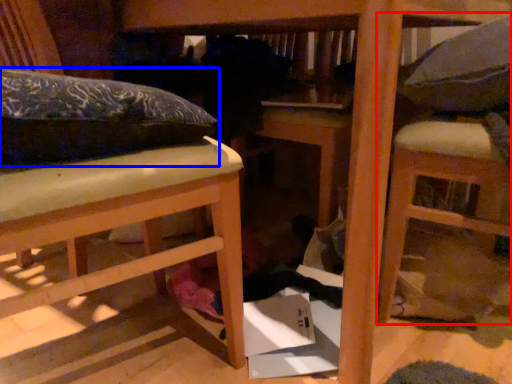
Question: Among these objects, which one is nearest to the camera, furniture (highlighted by a red box) or leftover (highlighted by a blue box)?

Choices:
 (A) furniture
 (B) leftover

Answer: (B)